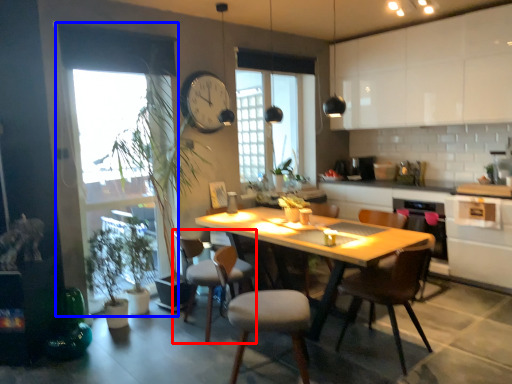
Question: Which point is further to the camera, chair (highlighted by a red box) or window screen (highlighted by a blue box)?

Choices:
 (A) chair
 (B) window screen

Answer: (A)